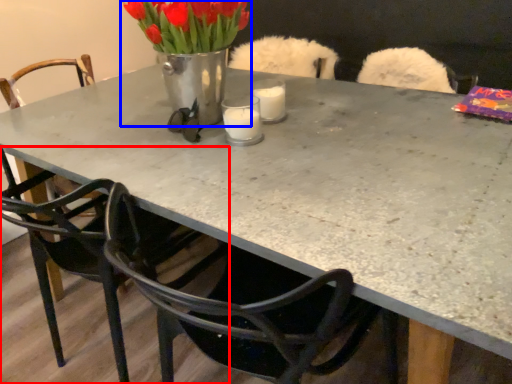
Question: Which of the following is the farthest to the observer, chair (highlighted by a red box) or floral arrangement (highlighted by a blue box)?

Choices:
 (A) chair
 (B) floral arrangement

Answer: (B)